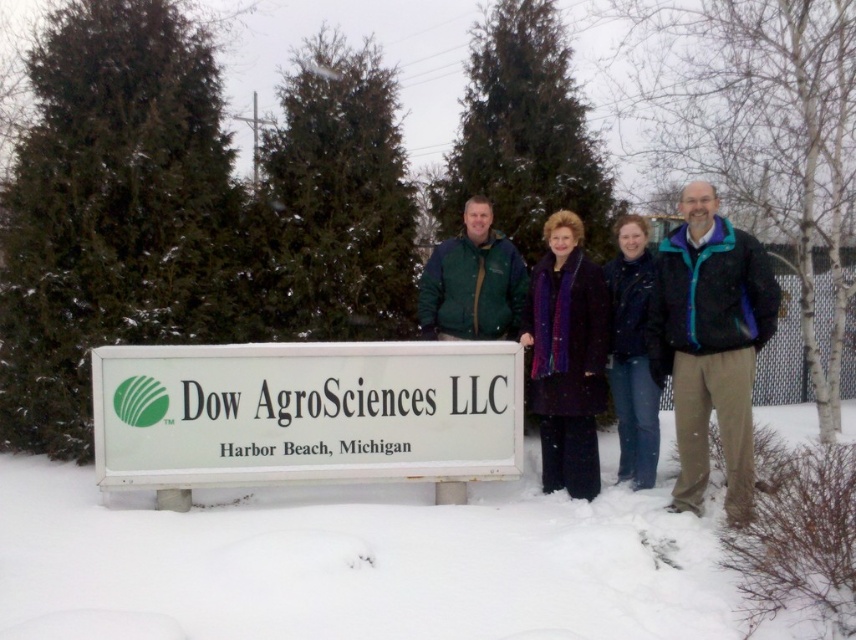
Does white plastic sign at center have a lesser width compared to purple wool coat at center?

No, white plastic sign at center is not thinner than purple wool coat at center.

Can you confirm if white plastic sign at center is positioned to the right of purple wool coat at center?

No, white plastic sign at center is not to the right of purple wool coat at center.

You are a GUI agent. You are given a task and a screenshot of the screen. Output one action in this format:
    pyautogui.click(x=<x>, y=<y>)
    Task: Click on the white plastic sign at center
    The width and height of the screenshot is (856, 640).
    Given the screenshot: What is the action you would take?
    pyautogui.click(x=305, y=413)

Which is more to the right, white powdery snow at lower center or blue denim jeans at lower right?

From the viewer's perspective, blue denim jeans at lower right appears more on the right side.

Between white powdery snow at lower center and blue denim jeans at lower right, which one appears on the left side from the viewer's perspective?

From the viewer's perspective, white powdery snow at lower center appears more on the left side.

Identify the location of white powdery snow at lower center. (358, 561).

Find the location of a particular element. The height and width of the screenshot is (640, 856). white powdery snow at lower center is located at coordinates (358, 561).

Locate an element on the screen. white powdery snow at lower center is located at coordinates (358, 561).

The height and width of the screenshot is (640, 856). I want to click on white powdery snow at lower center, so click(358, 561).